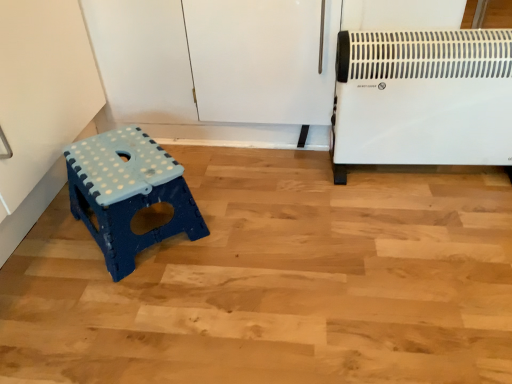
The height and width of the screenshot is (384, 512). I want to click on free point above blue plastic stool at lower left (from a real-world perspective), so click(120, 166).